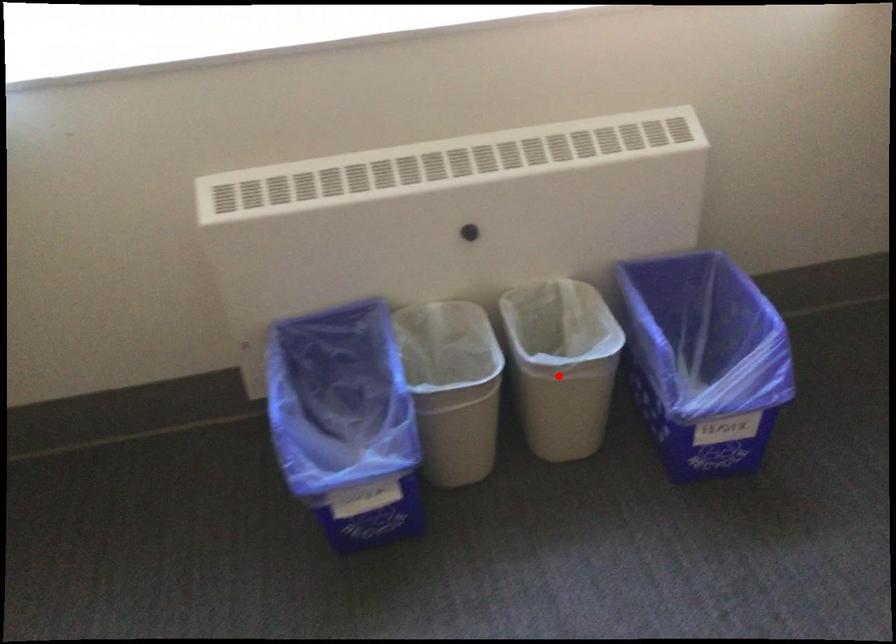
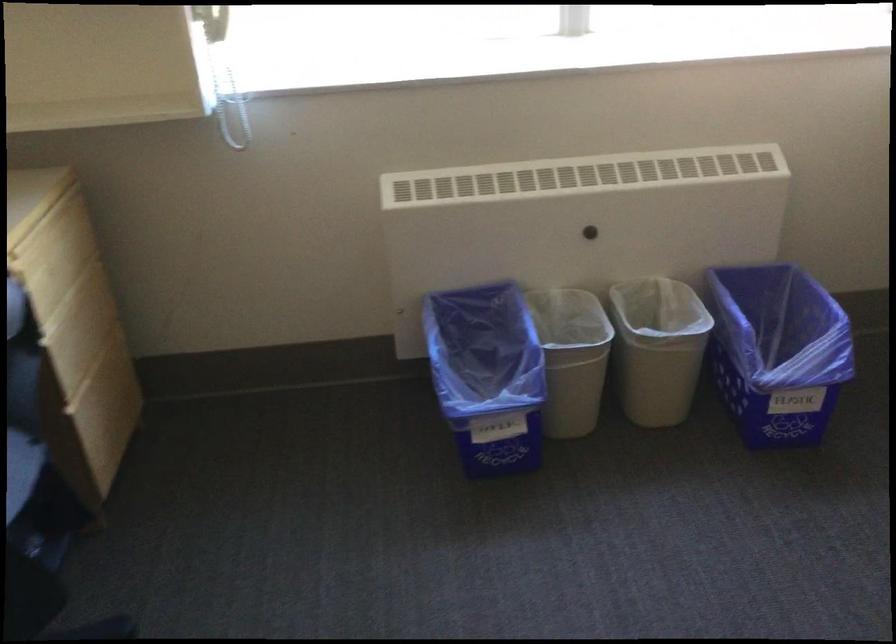
Locate, in the second image, the point that corresponds to the highlighted location in the first image.

(657, 348)